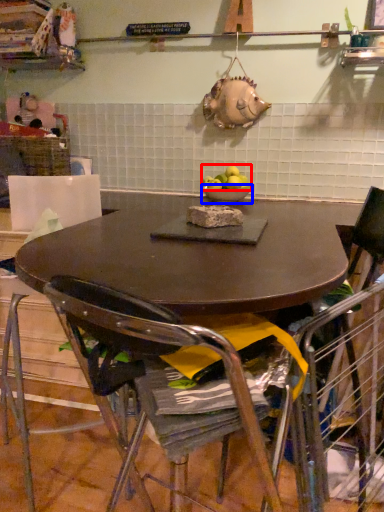
Question: Among these objects, which one is farthest to the camera, apple (highlighted by a red box) or bowl (highlighted by a blue box)?

Choices:
 (A) apple
 (B) bowl

Answer: (B)